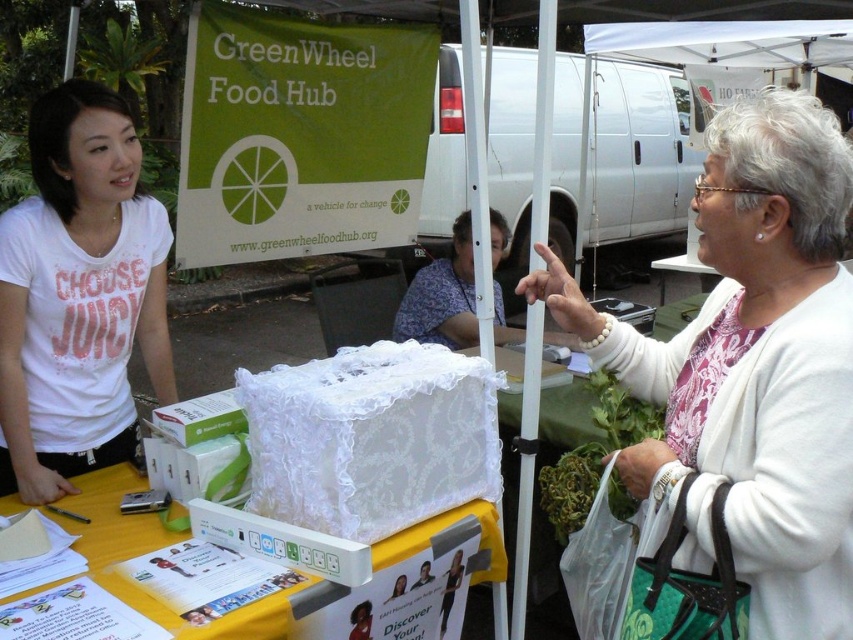
Does yellow fabric table at center have a larger size compared to floral fabric bag at center?

No.

Who is shorter, yellow fabric table at center or floral fabric bag at center?

Standing shorter between the two is yellow fabric table at center.

I want to click on yellow fabric table at center, so click(x=148, y=550).

Is the position of white lace box at center more distant than that of yellow fabric table at center?

No, it is not.

Is point (796, 256) positioned in front of point (117, 547)?

That is True.

The height and width of the screenshot is (640, 853). What are the coordinates of `white lace box at center` in the screenshot? It's located at (752, 365).

Does white t-shirt at upper left appear over yellow fabric table at center?

Yes.

Is white t-shirt at upper left positioned at the back of yellow fabric table at center?

Yes.

Who is more forward, (128, 269) or (260, 600)?

Point (260, 600)

In order to click on white t-shirt at upper left in this screenshot , I will do `click(78, 296)`.